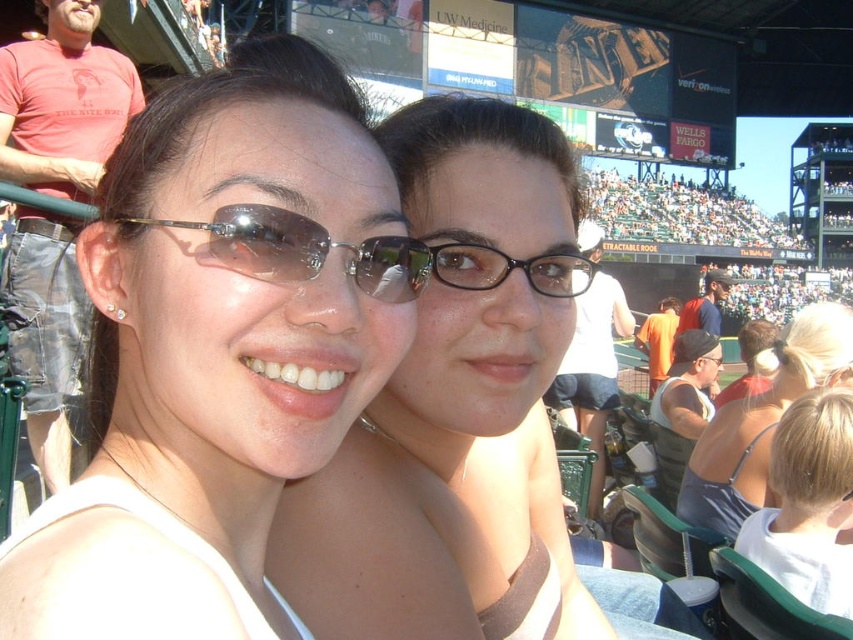
Between blonde hair at lower right and black plastic glasses at center, which one appears on the right side from the viewer's perspective?

blonde hair at lower right

Is blonde hair at lower right shorter than black plastic glasses at center?

No.

Where is `blonde hair at lower right`? blonde hair at lower right is located at coordinates (808, 504).

Who is lower down, matte black glasses at center or blonde hair at lower right?

Positioned lower is blonde hair at lower right.

The image size is (853, 640). Describe the element at coordinates (440, 481) in the screenshot. I see `matte black glasses at center` at that location.

You are a GUI agent. You are given a task and a screenshot of the screen. Output one action in this format:
    pyautogui.click(x=<x>, y=<y>)
    Task: Click on the matte black glasses at center
    
    Given the screenshot: What is the action you would take?
    click(x=440, y=481)

Which is in front, point (294, 132) or point (820, 576)?

Point (294, 132) is more forward.

Measure the distance between matte white tank top at center and camera.

matte white tank top at center and camera are 29.37 meters apart from each other.

Where is `matte white tank top at center`? matte white tank top at center is located at coordinates (218, 349).